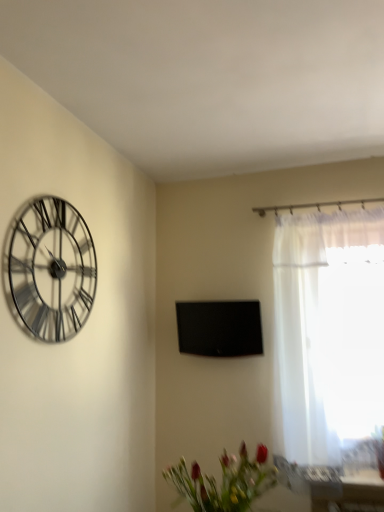
Question: In terms of width, does metallic silver clock at upper left look wider or thinner when compared to black glossy tv at center?

Choices:
 (A) wide
 (B) thin

Answer: (B)

Question: Considering the relative positions of metallic silver clock at upper left and black glossy tv at center in the image provided, is metallic silver clock at upper left to the left or to the right of black glossy tv at center?

Choices:
 (A) right
 (B) left

Answer: (B)

Question: Which object is positioned farthest from the metallic silver clock at upper left?

Choices:
 (A) black glossy tv at center
 (B) matte green vase at lower center
 (C) white sheer curtain at right

Answer: (C)

Question: Which of these objects is positioned closest to the black glossy tv at center?

Choices:
 (A) metallic silver clock at upper left
 (B) white sheer curtain at right
 (C) matte green vase at lower center

Answer: (B)